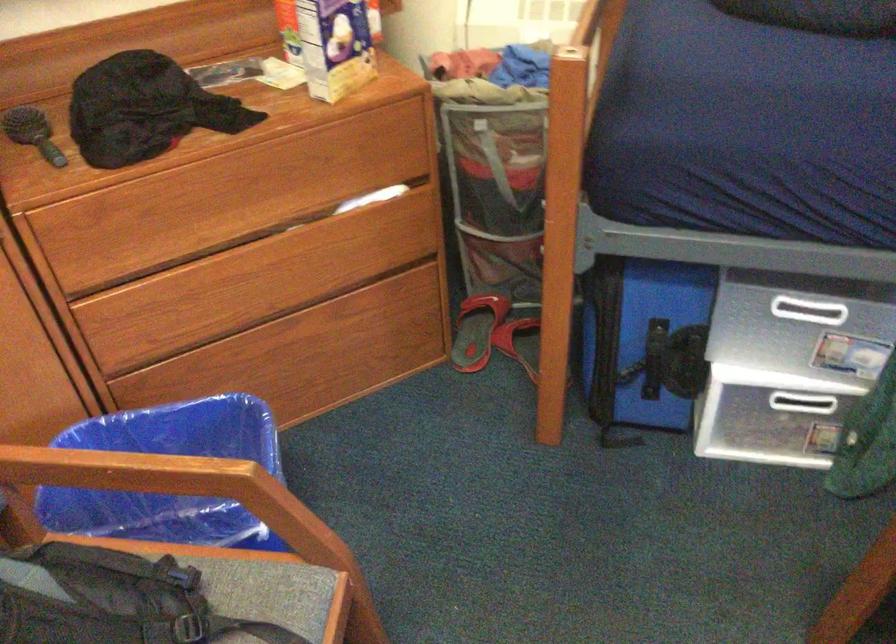
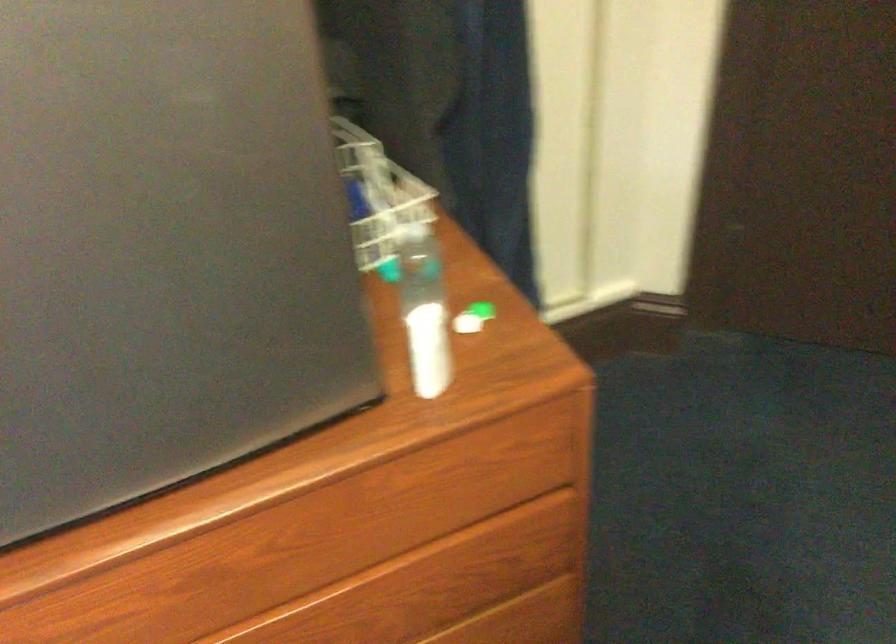
In the scene shown: How did the camera likely rotate?

The camera rotated toward left-down.